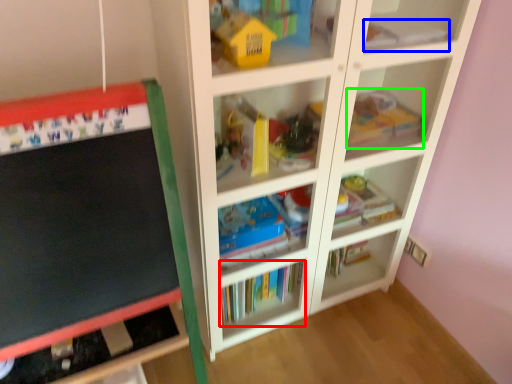
Question: Considering the real-world distances, which object is closest to book (highlighted by a red box)? book (highlighted by a blue box) or toy (highlighted by a green box).

Choices:
 (A) book
 (B) toy

Answer: (B)